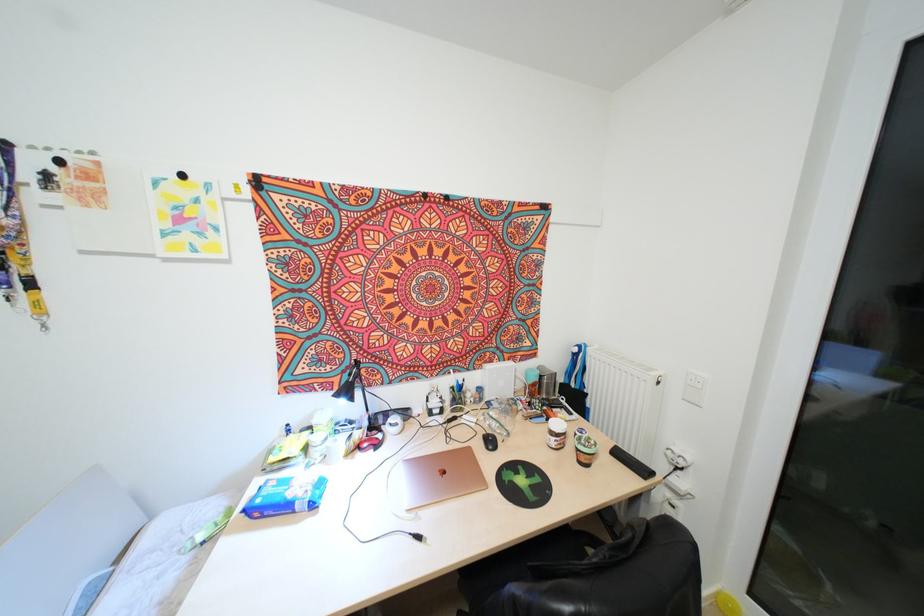
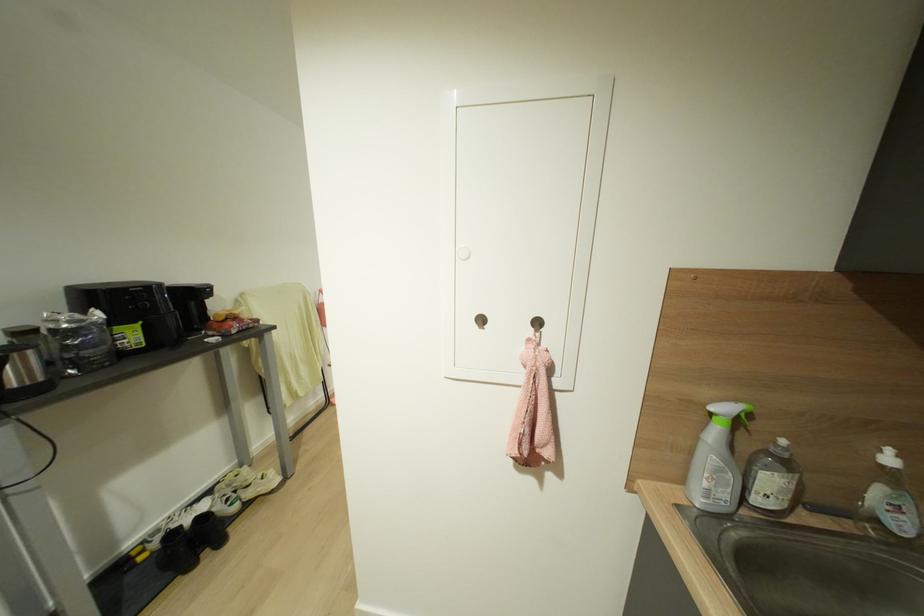
Question: I am providing you with two images of the same scene from different viewpoints. Which of the following objects are not visible in image2?

Choices:
 (A) red computer mouse
 (B) green spray trigger
 (C) metal wall hook
 (D) green plate

Answer: (A)